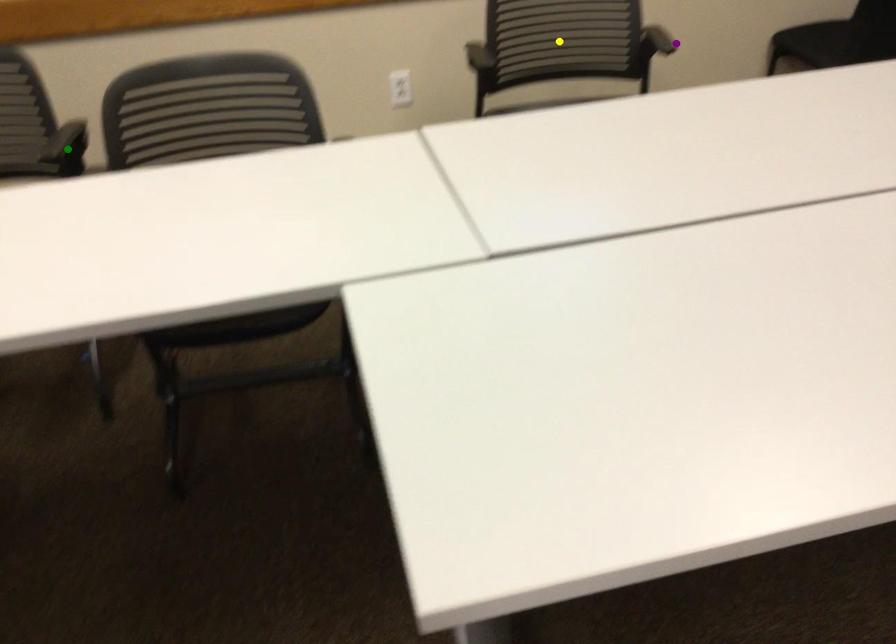
Order these from nearest to farthest:
purple point, yellow point, green point

green point < yellow point < purple point